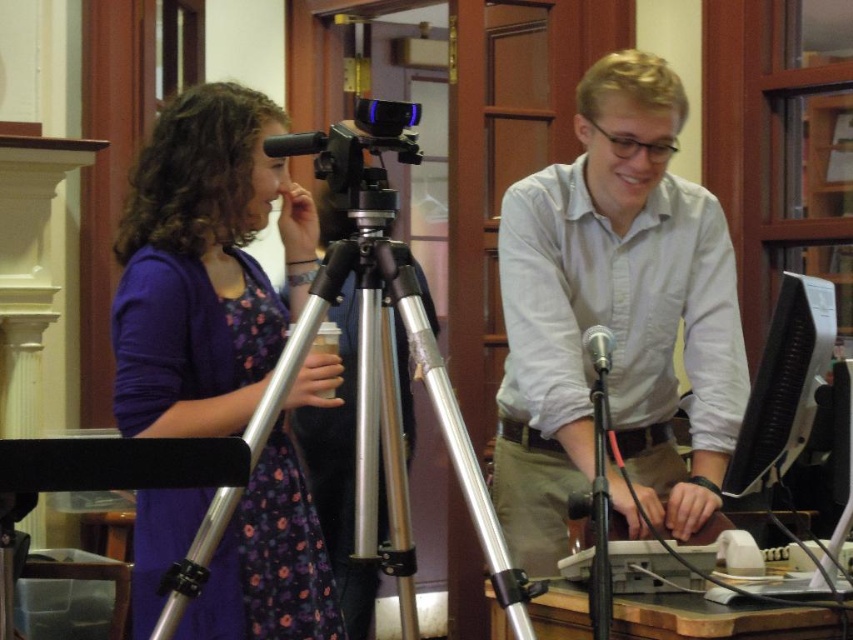
Question: Is silver metallic tripod at center bigger than black glossy monitor at right?

Choices:
 (A) no
 (B) yes

Answer: (B)

Question: Which point is farther to the camera?

Choices:
 (A) [x=618, y=170]
 (B) [x=762, y=396]
 (C) [x=201, y=145]

Answer: (A)

Question: Does purple fabric dress at left appear under silver metallic tripod at center?

Choices:
 (A) no
 (B) yes

Answer: (A)

Question: Which point appears farthest from the camera in this image?

Choices:
 (A) (578, 340)
 (B) (785, 296)
 (C) (376, 140)
 (D) (399, 448)

Answer: (A)

Question: Which object is closer to the camera taking this photo?

Choices:
 (A) silver metallic tripod at center
 (B) black plastic video camera at center
 (C) white cotton shirt at center
 (D) purple fabric dress at left

Answer: (A)

Question: Does silver metallic tripod at center appear on the right side of black plastic video camera at center?

Choices:
 (A) yes
 (B) no

Answer: (A)